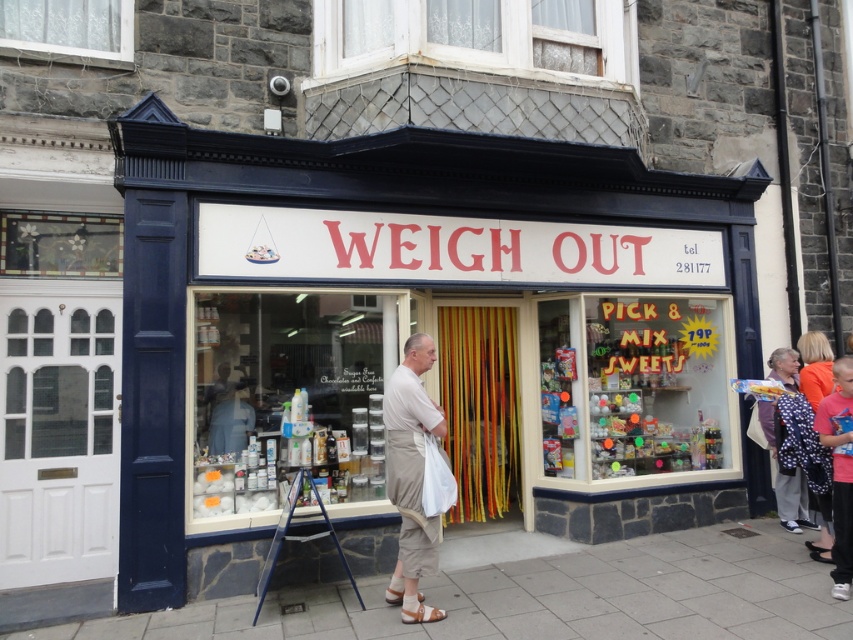
You are standing in front of the WEIGH OUT storefront and notice the gray concrete pavement at lower center and the polka dot dress at right. Which object is positioned lower in the image?

The gray concrete pavement at lower center is located below the polka dot dress at right, so it is positioned lower in the image.